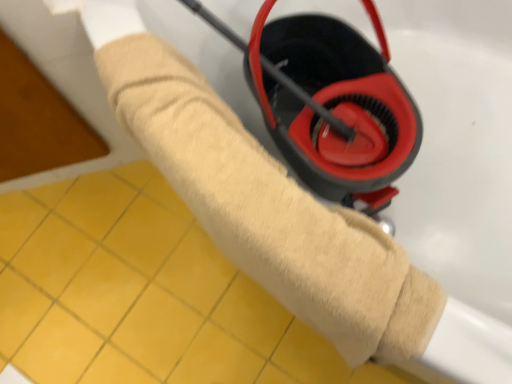
Image resolution: width=512 pixels, height=384 pixels. I want to click on beige plush towel at center, so click(x=270, y=210).

What is the approximate height of beige plush towel at center?

beige plush towel at center is 30.09 inches in height.

This screenshot has height=384, width=512. Describe the element at coordinates (270, 210) in the screenshot. I see `beige plush towel at center` at that location.

Where is `yellow tile at lower left`? Image resolution: width=512 pixels, height=384 pixels. yellow tile at lower left is located at coordinates (142, 294).

Describe the element at coordinates (142, 294) in the screenshot. I see `yellow tile at lower left` at that location.

You are a GUI agent. You are given a task and a screenshot of the screen. Output one action in this format:
    pyautogui.click(x=<x>, y=<y>)
    Task: Click on the beige plush towel at center
    This screenshot has width=512, height=384.
    Given the screenshot: What is the action you would take?
    click(x=270, y=210)

Does beige plush towel at center appear on the right side of yellow tile at lower left?

Correct, you'll find beige plush towel at center to the right of yellow tile at lower left.

Considering the relative positions of beige plush towel at center and yellow tile at lower left in the image provided, is beige plush towel at center behind yellow tile at lower left?

No, it is in front of yellow tile at lower left.

Is point (441, 293) farther from camera compared to point (38, 194)?

No.

From the image's perspective, is beige plush towel at center on top of yellow tile at lower left?

Indeed, from the image's perspective, beige plush towel at center is shown above yellow tile at lower left.

From a real-world perspective, is beige plush towel at center physically above yellow tile at lower left?

Correct, in the physical world, beige plush towel at center is higher than yellow tile at lower left.

Based on the photo, considering the relative sizes of beige plush towel at center and yellow tile at lower left in the image provided, is beige plush towel at center wider than yellow tile at lower left?

Correct, the width of beige plush towel at center exceeds that of yellow tile at lower left.

Does beige plush towel at center have a lesser height compared to yellow tile at lower left?

No.

Does beige plush towel at center have a smaller size compared to yellow tile at lower left?

Actually, beige plush towel at center might be larger than yellow tile at lower left.

Would you say beige plush towel at center contains yellow tile at lower left?

Definitely not — yellow tile at lower left is not inside beige plush towel at center.

Is beige plush towel at center not near yellow tile at lower left?

No, beige plush towel at center is not far away from yellow tile at lower left.

Is beige plush towel at center oriented away from yellow tile at lower left?

That's not correct — beige plush towel at center is not looking away from yellow tile at lower left.

How many degrees apart are the facing directions of beige plush towel at center and yellow tile at lower left?

The angular difference between beige plush towel at center and yellow tile at lower left is 0.418 degrees.

At what (x,y) coordinates should I click in order to perform the action: click on tile located behind the beige plush towel at center. Please return your answer as a coordinate pair (x, y). The image size is (512, 384). Looking at the image, I should click on (142, 294).

Considering the relative positions of yellow tile at lower left and beige plush towel at center in the image provided, is yellow tile at lower left to the right of beige plush towel at center from the viewer's perspective?

No, yellow tile at lower left is not to the right of beige plush towel at center.

Considering their positions, is yellow tile at lower left located in front of or behind beige plush towel at center?

Clearly, yellow tile at lower left is behind beige plush towel at center.

Considering the positions of points (106, 326) and (340, 226), is point (106, 326) closer to camera compared to point (340, 226)?

No, (106, 326) is further to viewer.

From the image's perspective, between yellow tile at lower left and beige plush towel at center, who is located below?

yellow tile at lower left is shown below in the image.

From the picture: From a real-world perspective, between yellow tile at lower left and beige plush towel at center, who is vertically lower?

From a 3D spatial view, yellow tile at lower left is below.

Between yellow tile at lower left and beige plush towel at center, which one has smaller width?

With smaller width is yellow tile at lower left.

Considering the sizes of objects yellow tile at lower left and beige plush towel at center in the image provided, who is taller, yellow tile at lower left or beige plush towel at center?

Standing taller between the two is beige plush towel at center.

Looking at this image, considering the relative sizes of yellow tile at lower left and beige plush towel at center in the image provided, is yellow tile at lower left bigger than beige plush towel at center?

Actually, yellow tile at lower left might be smaller than beige plush towel at center.

Does yellow tile at lower left contain beige plush towel at center?

That's incorrect, beige plush towel at center is not inside yellow tile at lower left.

Are yellow tile at lower left and beige plush towel at center making contact?

yellow tile at lower left and beige plush towel at center are clearly separated.

Is yellow tile at lower left aimed at beige plush towel at center?

No, yellow tile at lower left is not turned towards beige plush towel at center.

What's the angular difference between yellow tile at lower left and beige plush towel at center's facing directions?

The angle between the facing direction of yellow tile at lower left and the facing direction of beige plush towel at center is 0.418 degrees.

Find the location of a particular element. towel above the yellow tile at lower left (from the image's perspective) is located at coordinates (270, 210).

Image resolution: width=512 pixels, height=384 pixels. Identify the location of tile lying on the left of beige plush towel at center. (142, 294).

Where is `towel above the yellow tile at lower left (from the image's perspective)`? towel above the yellow tile at lower left (from the image's perspective) is located at coordinates (270, 210).